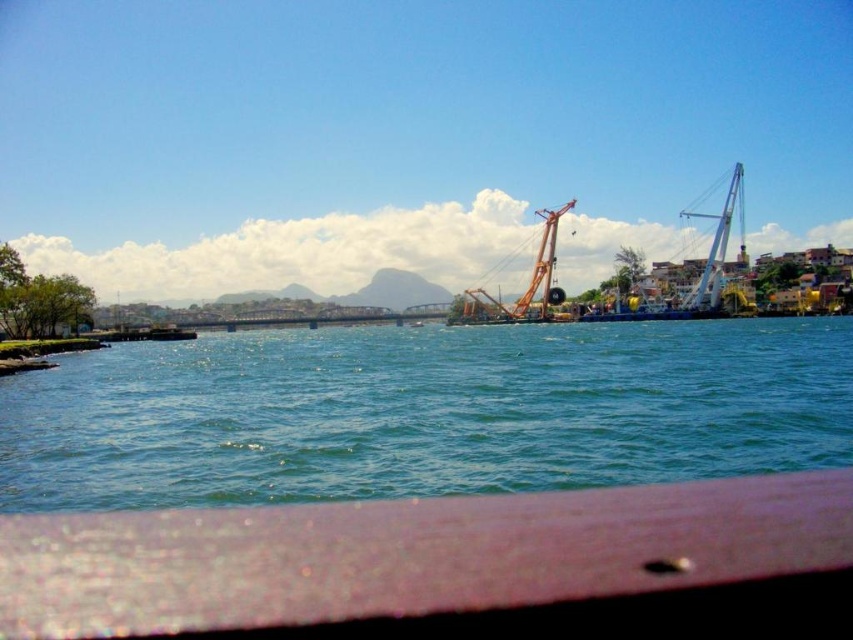
Is green water at center wider than orange metallic crane at center?

Indeed, green water at center has a greater width compared to orange metallic crane at center.

Is point (650, 403) positioned in front of point (489, 310)?

That is True.

Where is `green water at center`? green water at center is located at coordinates (422, 412).

From the picture: Can you confirm if white metallic crane at right is bigger than orange metallic crane at center?

Yes.

Does white metallic crane at right appear on the left side of orange metallic crane at center?

In fact, white metallic crane at right is to the right of orange metallic crane at center.

Is point (715, 230) positioned in front of point (469, 291)?

No.

This screenshot has height=640, width=853. What are the coordinates of `white metallic crane at right` in the screenshot? It's located at (699, 275).

Based on the photo, which is more to the right, green water at center or white metallic crane at right?

From the viewer's perspective, white metallic crane at right appears more on the right side.

Does green water at center appear on the left side of white metallic crane at right?

Yes, green water at center is to the left of white metallic crane at right.

Who is more forward, (537, 460) or (688, 316)?

Point (537, 460) is more forward.

The width and height of the screenshot is (853, 640). What are the coordinates of `green water at center` in the screenshot? It's located at (422, 412).